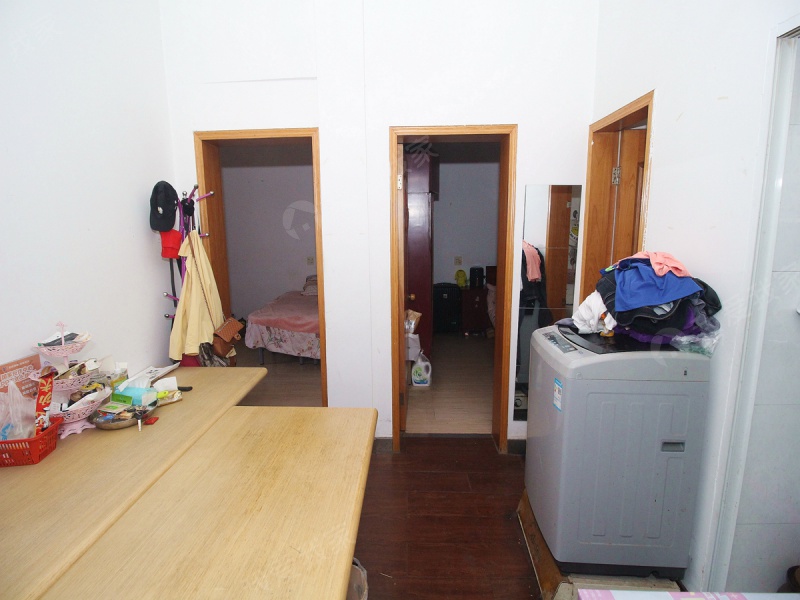
Locate an element on the screen. wooden table is located at coordinates (132, 489), (261, 492).